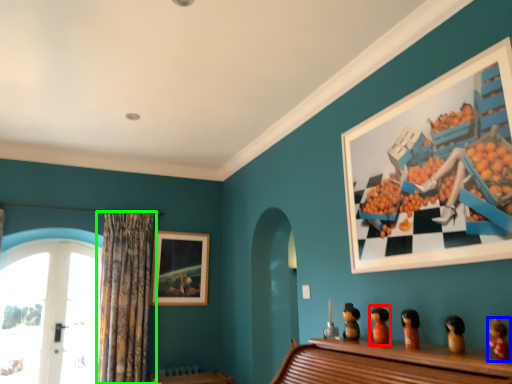
Question: Which object is the closest to the toy (highlighted by a red box)? Choose among these: toy (highlighted by a blue box) or curtain (highlighted by a green box).

Choices:
 (A) toy
 (B) curtain

Answer: (A)